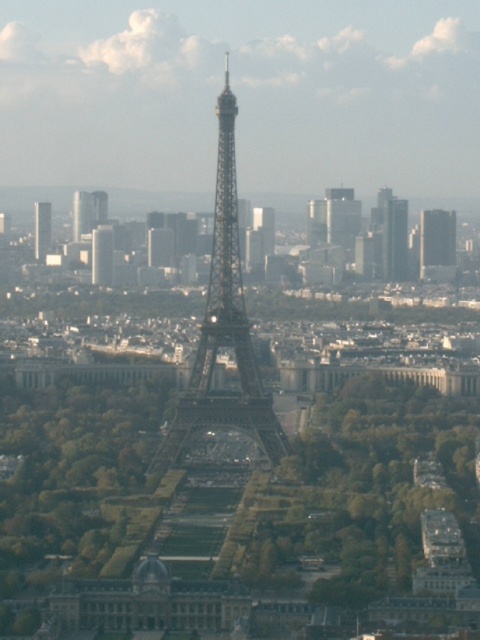
Question: Does green leafy trees at center come in front of smooth glass skyscraper at right?

Choices:
 (A) no
 (B) yes

Answer: (B)

Question: Which is farther from the smooth glass skyscraper at right?

Choices:
 (A) green leafy trees at center
 (B) matte black tower at left

Answer: (B)

Question: Can you confirm if smooth glass skyscraper at right is thinner than matte glass skyscraper at upper left?

Choices:
 (A) no
 (B) yes

Answer: (A)

Question: Which is nearer to the metallic structure at center?

Choices:
 (A) matte glass skyscraper at upper left
 (B) matte black tower at left

Answer: (A)

Question: Which point is farther to the camera?

Choices:
 (A) smooth glass skyscraper at right
 (B) green leafy trees at center
 (C) metallic structure at center
 (D) matte glass skyscraper at upper left

Answer: (A)

Question: Is metallic structure at center wider than matte black tower at left?

Choices:
 (A) yes
 (B) no

Answer: (A)